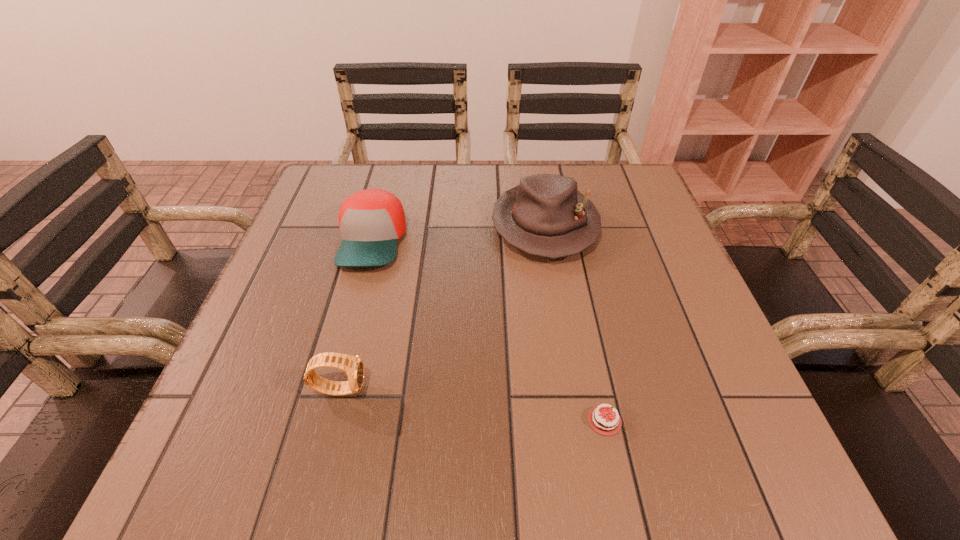
What are the coordinates of `hat` in the screenshot? It's located at (546, 216).

At what (x,y) coordinates should I click in order to perform the action: click on baseball cap. Please return your answer as a coordinate pair (x, y). Looking at the image, I should click on (371, 221).

Locate an element on the screen. Image resolution: width=960 pixels, height=540 pixels. watch is located at coordinates (353, 365).

Locate an element on the screen. The width and height of the screenshot is (960, 540). chocolate cake is located at coordinates (602, 421).

Where is `vacant space located on the decorative side of the hat`? This screenshot has width=960, height=540. vacant space located on the decorative side of the hat is located at coordinates (571, 384).

I want to click on free space located at the brim of the baseball cap, so click(312, 467).

This screenshot has height=540, width=960. I want to click on vacant region located 0.120m on the face of the watch, so click(x=439, y=388).

The height and width of the screenshot is (540, 960). Identify the location of vacant space located on the left of the chocolate cake. (524, 421).

Identify the location of hat present at the far edge. The image size is (960, 540). click(546, 216).

The width and height of the screenshot is (960, 540). Find the location of `baseball cap present at the far edge`. baseball cap present at the far edge is located at coordinates (371, 221).